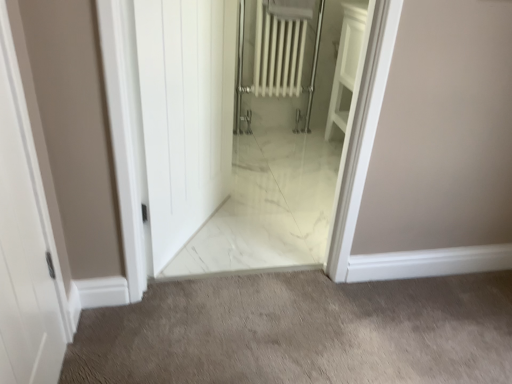
This screenshot has width=512, height=384. In order to click on empty space that is ontop of white marble floor at center (from a real-world perspective) in this screenshot , I will do `click(333, 324)`.